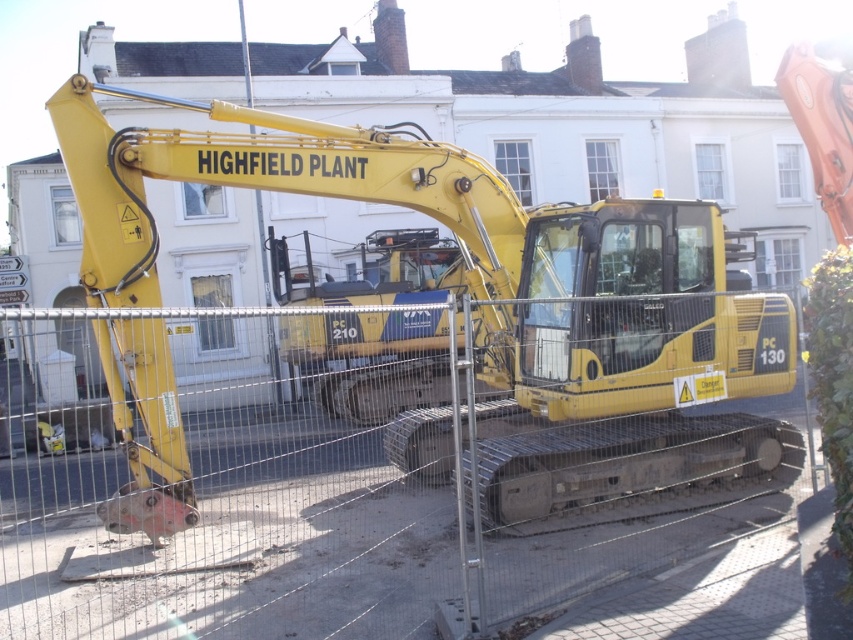
You are a delivery driver trying to pass through the area where the metal mesh fence at center and yellow rubber excavator at center are located. Can you drive through the gap between them?

The metal mesh fence at center is shorter than the yellow rubber excavator at center. Since the fence is lower, the gap between them might be too low for the vehicle to pass safely. It is recommended to find an alternative route or check the clearance height before attempting to drive through.

You are standing in front of the yellow excavator labeled HIGHFIELD PLANT and want to determine which of the two points, point (x=286, y=627) or point (x=757, y=448), is nearer to you. Based on the scene, which point is closer?

Point (x=286, y=627) is closer to the viewer than point (x=757, y=448).